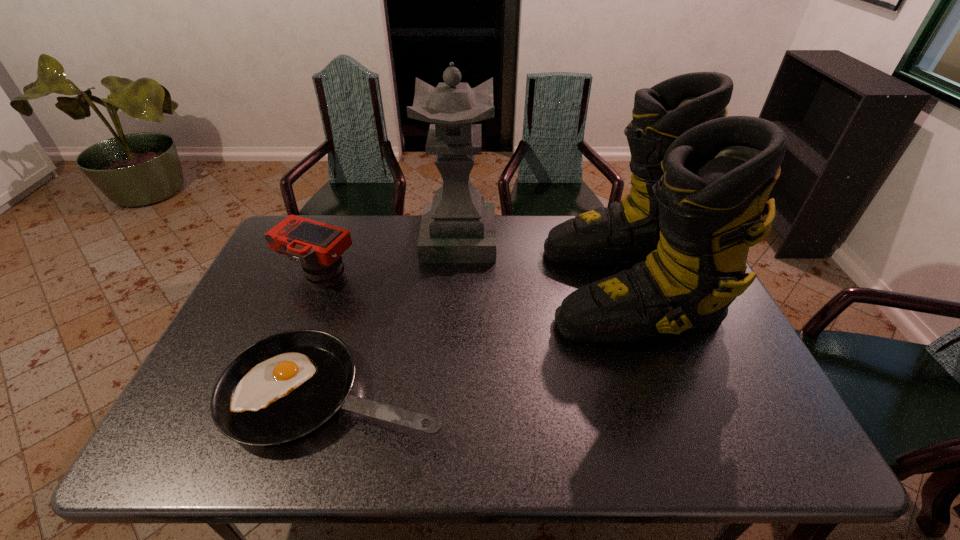
In the image, there is a desktop. Where is `blank space at the left edge`? The image size is (960, 540). blank space at the left edge is located at coordinates (208, 388).

Find the location of `vacant space at the right edge`. vacant space at the right edge is located at coordinates (745, 363).

Where is `vacant space at the near left corner of the desktop`? vacant space at the near left corner of the desktop is located at coordinates (207, 434).

At what (x,y) coordinates should I click in order to perform the action: click on unoccupied position between the sculpture and the ski boots. Please return your answer as a coordinate pair (x, y). The image size is (960, 540). Looking at the image, I should click on (542, 264).

The height and width of the screenshot is (540, 960). What are the coordinates of `free point between the shortest object and the rightmost object` in the screenshot? It's located at (481, 340).

Locate an element on the screen. free space between the shortest object and the ski boots is located at coordinates click(481, 340).

Locate an element on the screen. blank region between the shortest object and the sculpture is located at coordinates (397, 316).

The width and height of the screenshot is (960, 540). What are the coordinates of `free space between the ski boots and the sculpture` in the screenshot? It's located at (542, 264).

You are a GUI agent. You are given a task and a screenshot of the screen. Output one action in this format:
    pyautogui.click(x=<x>, y=<y>)
    Task: Click on the empty space that is in between the rightmost object and the third tallest object
    
    Given the screenshot: What is the action you would take?
    pyautogui.click(x=473, y=281)

You are a GUI agent. You are given a task and a screenshot of the screen. Output one action in this format:
    pyautogui.click(x=<x>, y=<y>)
    Task: Click on the empty space that is in between the camera and the sculpture
    The height and width of the screenshot is (540, 960).
    Given the screenshot: What is the action you would take?
    coord(389,258)